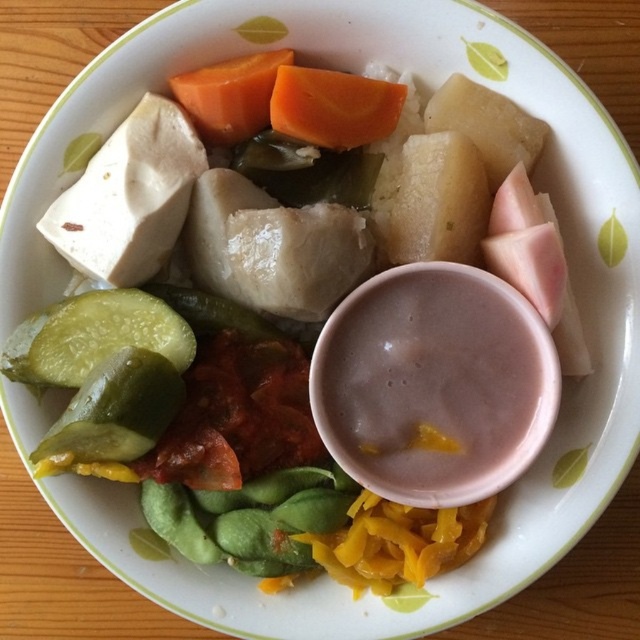
Question: Which point is closer to the camera taking this photo?

Choices:
 (A) [x=216, y=145]
 (B) [x=148, y=157]
 (C) [x=35, y=332]

Answer: (C)

Question: Among these points, which one is farthest from the camera?

Choices:
 (A) (269, 81)
 (B) (282, 112)

Answer: (A)

Question: Is the position of green glossy cucumber at lower left more distant than that of orange smooth carrot at center?

Choices:
 (A) yes
 (B) no

Answer: (A)

Question: Can you confirm if green glossy cucumber at lower left is positioned to the left of orange smooth carrot at upper center?

Choices:
 (A) yes
 (B) no

Answer: (A)

Question: Which of these objects is positioned closest to the orange smooth carrot at center?

Choices:
 (A) green pickled vegetable at lower left
 (B) green glossy cucumber at lower left
 (C) white soft tofu at upper left

Answer: (C)

Question: Does green pickled vegetable at lower left have a smaller size compared to orange smooth carrot at center?

Choices:
 (A) no
 (B) yes

Answer: (A)